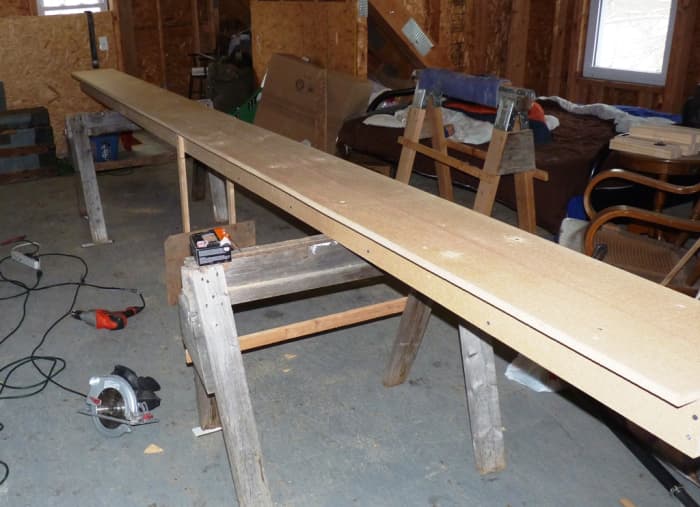
The image size is (700, 507). Identify the location of window. (640, 57).